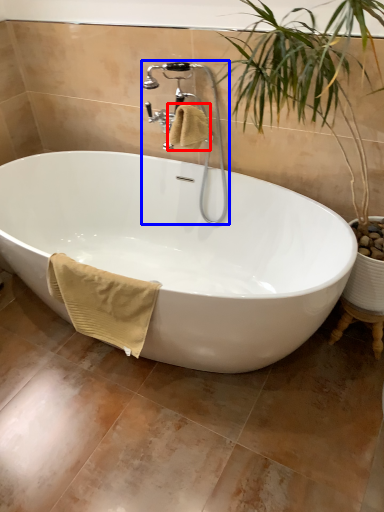
Question: Which of the following is the closest to the observer, bath towel (highlighted by a red box) or faucet (highlighted by a blue box)?

Choices:
 (A) bath towel
 (B) faucet

Answer: (B)